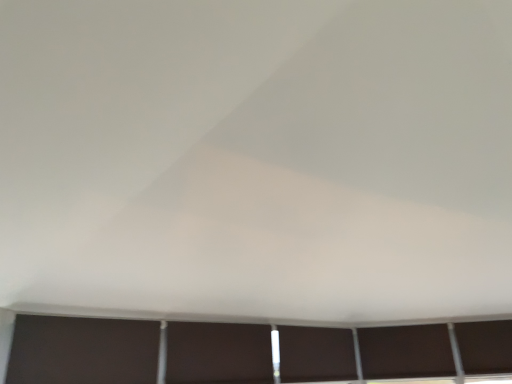
Question: From a real-world perspective, relative to dark matte window at bottom, positioned as the 3th window in right-to-left order, is dark matte window at lower right, which ranks as the 2th window in left-to-right order, vertically above or below?

Choices:
 (A) above
 (B) below

Answer: (A)

Question: Considering their positions, is dark matte window at lower right, which ranks as the 2th window in left-to-right order, located in front of or behind dark matte window at bottom, positioned as the 3th window in right-to-left order?

Choices:
 (A) front
 (B) behind

Answer: (B)

Question: Estimate the real-world distances between objects in this image. Which object is closer to the dark matte window at bottom, the first window from the left?

Choices:
 (A) dark matte window at lower right, which ranks as the 2th window in left-to-right order
 (B) matte brown shutter at center, the first shutter positioned from the back
 (C) dark brown matte window at lower right, placed as the 1th window when sorted from right to left
 (D) dark matte shutter at lower left, the 1th shutter when ordered from front to back

Answer: (A)

Question: Considering the real-world distances, which object is closest to the dark matte window at bottom, positioned as the 3th window in right-to-left order?

Choices:
 (A) dark matte window at lower right, which ranks as the 2th window in left-to-right order
 (B) dark matte shutter at lower left, arranged as the second shutter when viewed from the back
 (C) matte brown shutter at center, the first shutter positioned from the back
 (D) dark brown matte window at lower right, placed as the 1th window when sorted from right to left

Answer: (A)